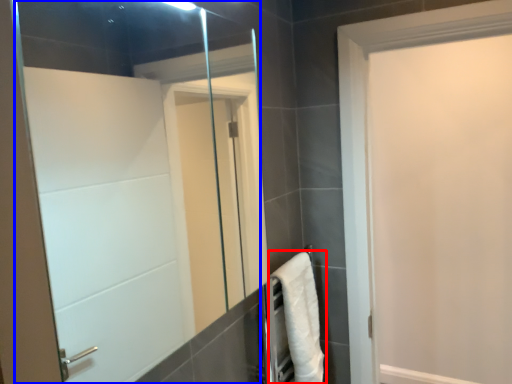
Question: Among these objects, which one is nearest to the camera, bath towel (highlighted by a red box) or mirror (highlighted by a blue box)?

Choices:
 (A) bath towel
 (B) mirror

Answer: (B)